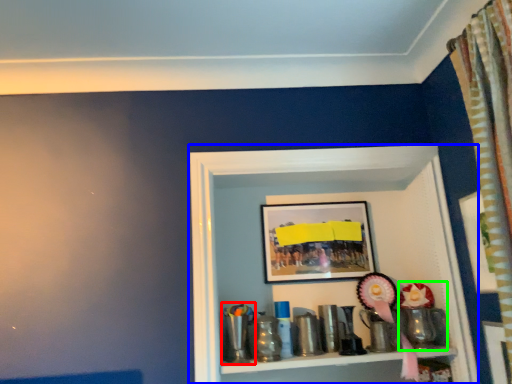
Question: Which is farther away from toy (highlighted by a red box)? shelf (highlighted by a blue box) or toy (highlighted by a green box)?

Choices:
 (A) shelf
 (B) toy

Answer: (B)